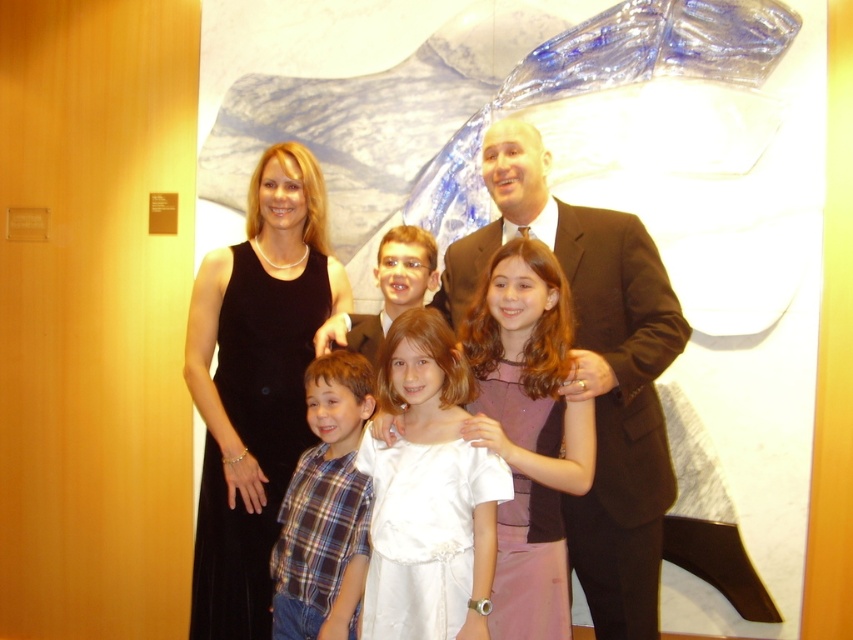
Question: Which of the following is the closest to the observer?

Choices:
 (A) (434, 432)
 (B) (345, 465)
 (C) (634, 490)

Answer: (A)

Question: Does dark brown suit at center appear on the right side of plaid shirt at center?

Choices:
 (A) no
 (B) yes

Answer: (B)

Question: Is the position of black dress at center less distant than that of white satin dress at center?

Choices:
 (A) yes
 (B) no

Answer: (B)

Question: Which point appears farthest from the camera in this image?

Choices:
 (A) (276, 550)
 (B) (265, 477)
 (C) (402, 460)

Answer: (B)

Question: Which of these objects is positioned closest to the dark brown suit at center?

Choices:
 (A) plaid shirt at center
 (B) black dress at center

Answer: (A)

Question: Can you confirm if white satin dress at center is positioned below plaid shirt at center?

Choices:
 (A) yes
 (B) no

Answer: (B)